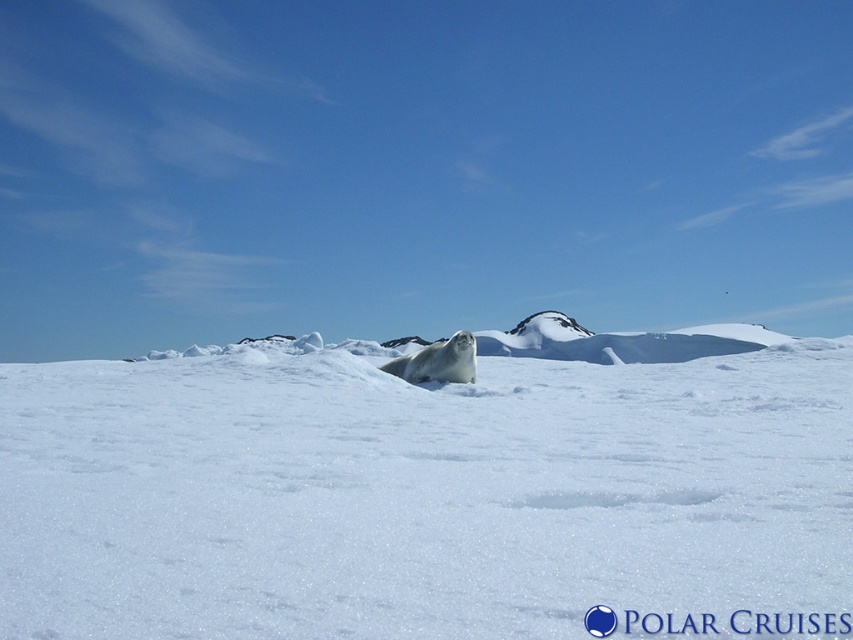
Question: Does white fluffy snow at center appear on the right side of white fur seal at center?

Choices:
 (A) yes
 (B) no

Answer: (B)

Question: Which of the following is the farthest from the observer?

Choices:
 (A) white fluffy snow at center
 (B) white fur seal at center

Answer: (B)

Question: Which of the following is the closest to the observer?

Choices:
 (A) (474, 353)
 (B) (337, 572)

Answer: (B)

Question: Does white fluffy snow at center appear under white fur seal at center?

Choices:
 (A) no
 (B) yes

Answer: (A)

Question: Which point is farther to the camera?

Choices:
 (A) white fluffy snow at center
 (B) white fur seal at center

Answer: (B)

Question: Is white fluffy snow at center further to camera compared to white fur seal at center?

Choices:
 (A) no
 (B) yes

Answer: (A)